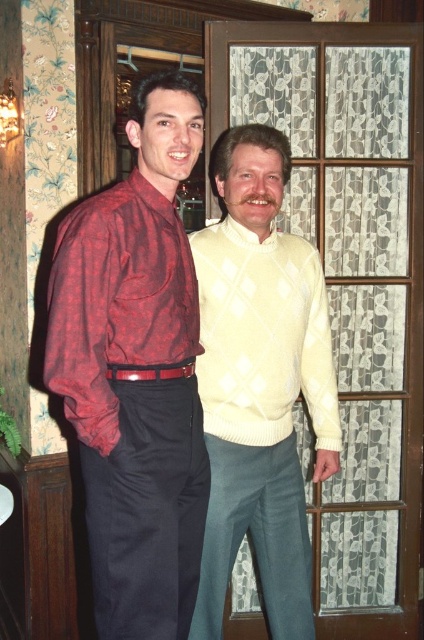
Is plaid shirt at left above cream knitted sweater at center?

Actually, plaid shirt at left is below cream knitted sweater at center.

You are a GUI agent. You are given a task and a screenshot of the screen. Output one action in this format:
    pyautogui.click(x=<x>, y=<y>)
    Task: Click on the plaid shirt at left
    
    Given the screenshot: What is the action you would take?
    pyautogui.click(x=136, y=371)

Is plaid shirt at left to the left of matte red plaid shirt at left from the viewer's perspective?

Correct, you'll find plaid shirt at left to the left of matte red plaid shirt at left.

Is point (98, 308) behind point (80, 426)?

Yes, point (98, 308) is farther from viewer.

You are a GUI agent. You are given a task and a screenshot of the screen. Output one action in this format:
    pyautogui.click(x=<x>, y=<y>)
    Task: Click on the plaid shirt at left
    This screenshot has width=424, height=640.
    Given the screenshot: What is the action you would take?
    pyautogui.click(x=136, y=371)

Does matte yellow sweater at center appear under cream knitted sweater at center?

Yes.

Is point (267, 432) more distant than point (229, 324)?

Yes.

What do you see at coordinates (259, 384) in the screenshot? This screenshot has width=424, height=640. I see `matte yellow sweater at center` at bounding box center [259, 384].

The height and width of the screenshot is (640, 424). Find the location of `matte yellow sweater at center`. matte yellow sweater at center is located at coordinates (259, 384).